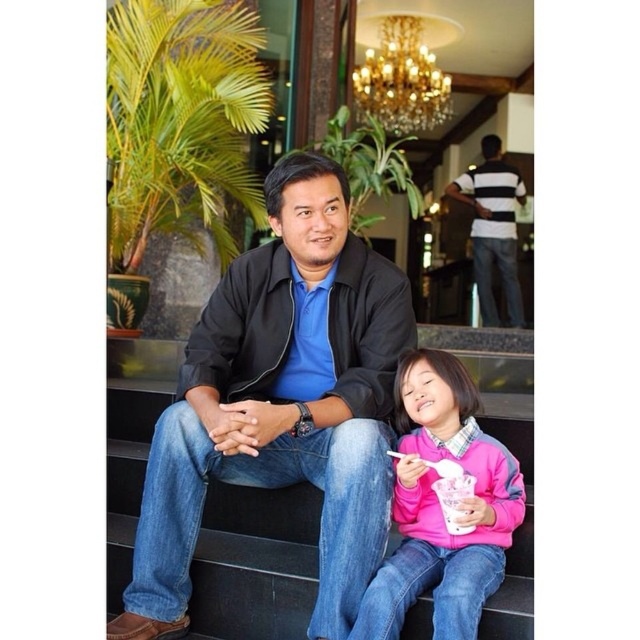
Question: Which point appears closest to the camera in this image?

Choices:
 (A) (429, 547)
 (B) (490, 193)
 (C) (358, 522)

Answer: (C)

Question: Which is farther from the pink fleece sweater at lower right?

Choices:
 (A) gold metallic chandelier at upper center
 (B) smooth black stairs at center
 (C) black leather jacket at center
 (D) white striped shirt at upper center

Answer: (A)

Question: Does smooth black stairs at center have a greater width compared to pink fleece sweater at lower right?

Choices:
 (A) no
 (B) yes

Answer: (A)

Question: Is black leather jacket at center thinner than pink fleece sweater at lower right?

Choices:
 (A) yes
 (B) no

Answer: (B)

Question: Which point is closer to the camera?

Choices:
 (A) (401, 324)
 (B) (368, 628)
 (C) (518, 177)

Answer: (B)

Question: Is black leather jacket at center positioned at the back of white striped shirt at upper center?

Choices:
 (A) yes
 (B) no

Answer: (B)